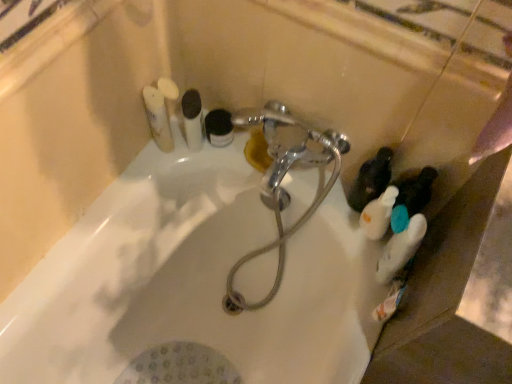
The width and height of the screenshot is (512, 384). Identify the location of white glossy bathtub at center. (192, 280).

This screenshot has height=384, width=512. What do you see at coordinates (378, 214) in the screenshot? I see `white matte bottle at right, which is the sixth toiletry from left to right` at bounding box center [378, 214].

Identify the location of black matte jar at upper center, the 4th toiletry from the left. The width and height of the screenshot is (512, 384). (219, 127).

At what (x,y) coordinates should I click in order to perform the action: click on white matte toothpaste tube at upper left, arranged as the first toiletry when viewed from the left. Please return your answer as a coordinate pair (x, y). The width and height of the screenshot is (512, 384). Looking at the image, I should click on pyautogui.click(x=158, y=118).

The height and width of the screenshot is (384, 512). Describe the element at coordinates (192, 119) in the screenshot. I see `white glossy tube at upper center, the fourth toiletry from the right` at that location.

This screenshot has width=512, height=384. I want to click on white glossy bathtub at center, so point(192,280).

How many degrees apart are the facing directions of white glossy tube at upper center, which is counted as the third toiletry, starting from the left, and white glossy bathtub at center?

white glossy tube at upper center, which is counted as the third toiletry, starting from the left, and white glossy bathtub at center are facing 92.3 degrees away from each other.

Can you confirm if white glossy tube at upper center, the fourth toiletry from the right, is bigger than white glossy bathtub at center?

Incorrect, white glossy tube at upper center, the fourth toiletry from the right, is not larger than white glossy bathtub at center.

Is white glossy tube at upper center, the fourth toiletry from the right, thinner than white glossy bathtub at center?

Yes.

Could white glossy bathtub at center be considered to be inside white glossy tube at upper center, the fourth toiletry from the right?

No, white glossy bathtub at center is not surrounded by white glossy tube at upper center, the fourth toiletry from the right.

Is white glossy bathtub at center aimed at white matte toothpaste tube at upper left, which appears as the 6th toiletry when viewed from the right?

No, white glossy bathtub at center does not turn towards white matte toothpaste tube at upper left, which appears as the 6th toiletry when viewed from the right.

From the white glossy bathtub at center, count 3rd toiletrys backward and point to it. Please provide its 2D coordinates.

[(158, 118)]

Consider the image. Is white glossy bathtub at center at the left side of white matte toothpaste tube at upper left, arranged as the first toiletry when viewed from the left?

No, white glossy bathtub at center is not to the left of white matte toothpaste tube at upper left, arranged as the first toiletry when viewed from the left.

Which point is more forward, [93,333] or [160,146]?

The point [160,146] is closer.

From the image's perspective, is white matte bottle at lower right on white matte toothbrushes at upper left, which is the second toiletry from left to right?

No, from the image's perspective, white matte bottle at lower right is not over white matte toothbrushes at upper left, which is the second toiletry from left to right.

Which is behind, point (419, 222) or point (173, 106)?

The point (173, 106) is more distant.

Is white matte bottle at lower right to the left or to the right of white matte toothbrushes at upper left, which is the second toiletry from left to right, in the image?

Based on their positions, white matte bottle at lower right is located to the right of white matte toothbrushes at upper left, which is the second toiletry from left to right.

Consider the image. Which is in front, white matte bottle at lower right or white matte toothbrushes at upper left, arranged as the 5th toiletry when viewed from the right?

white matte bottle at lower right is in front.

Would you consider white glossy bathtub at center to be distant from white matte bottle at right, the 1th toiletry in the right-to-left sequence?

white glossy bathtub at center is near white matte bottle at right, the 1th toiletry in the right-to-left sequence, not far away.

From the image's perspective, which one is positioned lower, white glossy bathtub at center or white matte bottle at right, which is the sixth toiletry from left to right?

white glossy bathtub at center is shown below in the image.

Is white glossy bathtub at center not within white matte bottle at right, the 1th toiletry in the right-to-left sequence?

Yes, white glossy bathtub at center is located beyond the bounds of white matte bottle at right, the 1th toiletry in the right-to-left sequence.

Is white glossy tube at upper center, the fourth toiletry from the right, taller than white matte toothpaste tube at upper left, arranged as the first toiletry when viewed from the left?

In fact, white glossy tube at upper center, the fourth toiletry from the right, may be shorter than white matte toothpaste tube at upper left, arranged as the first toiletry when viewed from the left.

Which object is wider, white glossy tube at upper center, the fourth toiletry from the right, or white matte toothpaste tube at upper left, arranged as the first toiletry when viewed from the left?

white matte toothpaste tube at upper left, arranged as the first toiletry when viewed from the left.

You are a GUI agent. You are given a task and a screenshot of the screen. Output one action in this format:
    pyautogui.click(x=<x>, y=<y>)
    Task: Click on the 1st toiletry below the white matte toothpaste tube at upper left, which appears as the 6th toiletry when viewed from the right (from the image's perspective)
    
    Given the screenshot: What is the action you would take?
    pyautogui.click(x=192, y=119)

From a real-world perspective, is white glossy tube at upper center, which is counted as the third toiletry, starting from the left, positioned over white matte toothpaste tube at upper left, which appears as the 6th toiletry when viewed from the right, based on gravity?

Incorrect, from a real-world perspective, white glossy tube at upper center, which is counted as the third toiletry, starting from the left, is lower than white matte toothpaste tube at upper left, which appears as the 6th toiletry when viewed from the right.

In terms of width, does white matte toothbrushes at upper left, which is the second toiletry from left to right, look wider or thinner when compared to white glossy bathtub at center?

white matte toothbrushes at upper left, which is the second toiletry from left to right, is thinner than white glossy bathtub at center.

From a real-world perspective, which is physically above, white matte toothbrushes at upper left, which is the second toiletry from left to right, or white glossy bathtub at center?

white matte toothbrushes at upper left, which is the second toiletry from left to right, is physically above.

Does white matte toothbrushes at upper left, which is the second toiletry from left to right, appear on the right side of white glossy bathtub at center?

No.

Between white matte bottle at right, the 1th toiletry in the right-to-left sequence, and white matte toothpaste tube at upper left, arranged as the first toiletry when viewed from the left, which one has smaller width?

Thinner between the two is white matte bottle at right, the 1th toiletry in the right-to-left sequence.

From the image's perspective, which is above, white matte bottle at right, the 1th toiletry in the right-to-left sequence, or white matte toothpaste tube at upper left, which appears as the 6th toiletry when viewed from the right?

From the image's view, white matte toothpaste tube at upper left, which appears as the 6th toiletry when viewed from the right, is above.

Is white matte bottle at right, the 1th toiletry in the right-to-left sequence, far away from white matte toothpaste tube at upper left, arranged as the first toiletry when viewed from the left?

That's not correct — white matte bottle at right, the 1th toiletry in the right-to-left sequence, is a little close to white matte toothpaste tube at upper left, arranged as the first toiletry when viewed from the left.

Between white matte bottle at right, which is the sixth toiletry from left to right, and white matte toothpaste tube at upper left, arranged as the first toiletry when viewed from the left, which one has less height?

With less height is white matte toothpaste tube at upper left, arranged as the first toiletry when viewed from the left.

You are a GUI agent. You are given a task and a screenshot of the screen. Output one action in this format:
    pyautogui.click(x=<x>, y=<y>)
    Task: Click on the bath below the white glossy tube at upper center, the fourth toiletry from the right (from the image's perspective)
    Image resolution: width=512 pixels, height=384 pixels.
    Given the screenshot: What is the action you would take?
    pyautogui.click(x=192, y=280)

Identify the location of bath below the white matte toothpaste tube at upper left, which appears as the 6th toiletry when viewed from the right (from a real-world perspective). Image resolution: width=512 pixels, height=384 pixels. (192, 280).

Considering their positions, is white glossy tube at upper center, the fourth toiletry from the right, positioned further to white glossy bathtub at center than white matte bottle at lower right?

Based on the image, white matte bottle at lower right appears to be further to white glossy bathtub at center.

Considering their positions, is white matte toothbrushes at upper left, arranged as the 5th toiletry when viewed from the right, positioned further to white matte bottle at right, which is the sixth toiletry from left to right, than white glossy tube at upper center, the fourth toiletry from the right?

Based on the image, white matte toothbrushes at upper left, arranged as the 5th toiletry when viewed from the right, appears to be further to white matte bottle at right, which is the sixth toiletry from left to right.

Based on their spatial positions, is white matte toothbrushes at upper left, which is the second toiletry from left to right, or white matte toothpaste tube at upper left, which appears as the 6th toiletry when viewed from the right, closer to white matte bottle at right, the 1th toiletry in the right-to-left sequence?

white matte toothpaste tube at upper left, which appears as the 6th toiletry when viewed from the right.

Which object lies further to the anchor point white glossy tube at upper center, the fourth toiletry from the right, white matte toothpaste tube at upper left, which appears as the 6th toiletry when viewed from the right, or white matte toothbrushes at upper left, arranged as the 5th toiletry when viewed from the right?

white matte toothpaste tube at upper left, which appears as the 6th toiletry when viewed from the right, is positioned further to the anchor white glossy tube at upper center, the fourth toiletry from the right.

Which object lies further to the anchor point white glossy bathtub at center, black matte jar at upper center, marked as the 3th toiletry in a right-to-left arrangement, or chrome metallic faucet at center?

black matte jar at upper center, marked as the 3th toiletry in a right-to-left arrangement, lies further to white glossy bathtub at center than the other object.

Considering their positions, is white matte bottle at right, the 1th toiletry in the right-to-left sequence, positioned closer to white matte bottle at lower right than white matte toothbrushes at upper left, which is the second toiletry from left to right?

white matte bottle at right, the 1th toiletry in the right-to-left sequence.

Based on their spatial positions, is white matte toothbrushes at upper left, arranged as the 5th toiletry when viewed from the right, or black matte jar at upper center, marked as the 3th toiletry in a right-to-left arrangement, further from white glossy tube at upper center, which is counted as the third toiletry, starting from the left?

Based on the image, white matte toothbrushes at upper left, arranged as the 5th toiletry when viewed from the right, appears to be further to white glossy tube at upper center, which is counted as the third toiletry, starting from the left.

From the image, which object appears to be nearer to white glossy bathtub at center, white glossy tube at upper center, the fourth toiletry from the right, or black matte jar at upper center, marked as the 3th toiletry in a right-to-left arrangement?

white glossy tube at upper center, the fourth toiletry from the right, lies closer to white glossy bathtub at center than the other object.

You are a GUI agent. You are given a task and a screenshot of the screen. Output one action in this format:
    pyautogui.click(x=<x>, y=<y>)
    Task: Click on the toiletry located between white matte toothbrushes at upper left, which is the second toiletry from left to right, and black matte jar at upper center, marked as the 3th toiletry in a right-to-left arrangement, in the left-right direction
    This screenshot has height=384, width=512.
    Given the screenshot: What is the action you would take?
    pyautogui.click(x=192, y=119)

At what (x,y) coordinates should I click in order to perform the action: click on bath situated between white matte toothpaste tube at upper left, which appears as the 6th toiletry when viewed from the right, and white matte bottle at right, which is the sixth toiletry from left to right, from left to right. Please return your answer as a coordinate pair (x, y). Image resolution: width=512 pixels, height=384 pixels. Looking at the image, I should click on (192, 280).

Where is `plumbing fixture between white matte toothbrushes at upper left, arranged as the 5th toiletry when viewed from the right, and white glossy bathtub at center in the up-down direction`? The image size is (512, 384). plumbing fixture between white matte toothbrushes at upper left, arranged as the 5th toiletry when viewed from the right, and white glossy bathtub at center in the up-down direction is located at coordinates (284, 190).

At what (x,y) coordinates should I click in order to perform the action: click on plumbing fixture between white matte toothbrushes at upper left, arranged as the 5th toiletry when viewed from the right, and white matte bottle at right, the 1th toiletry in the right-to-left sequence, in the horizontal direction. Please return your answer as a coordinate pair (x, y). The width and height of the screenshot is (512, 384). Looking at the image, I should click on pos(284,190).